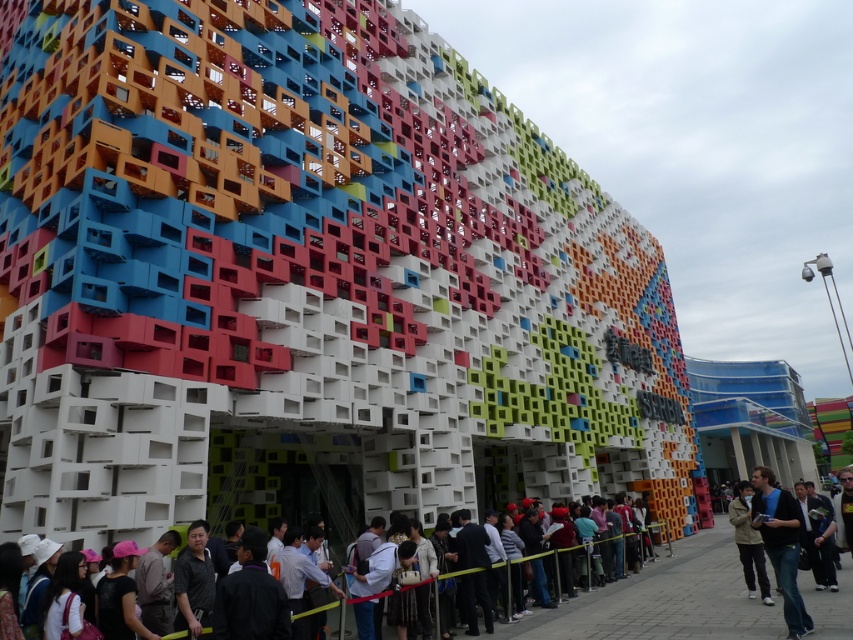
You are standing at the entrance of the building and want to find the dark gray suit at center. According to the coordinates provided, in which direction should you look to locate it?

The dark gray suit at center is located at coordinates point (596,612), so you should look towards the lower right direction from the entrance to locate it.

You are a photographer standing in front of the modern building with colorful cubes. You notice two people in the queue wearing a dark gray suit at center and dark blue jeans at lower right. Which person should you choose to take a closeup portrait if you want to focus on someone with a wider clothing item?

The dark gray suit at center has a greater width than the dark blue jeans at lower right, so you should choose the person wearing the dark gray suit at center for the closeup portrait to focus on the wider clothing item.